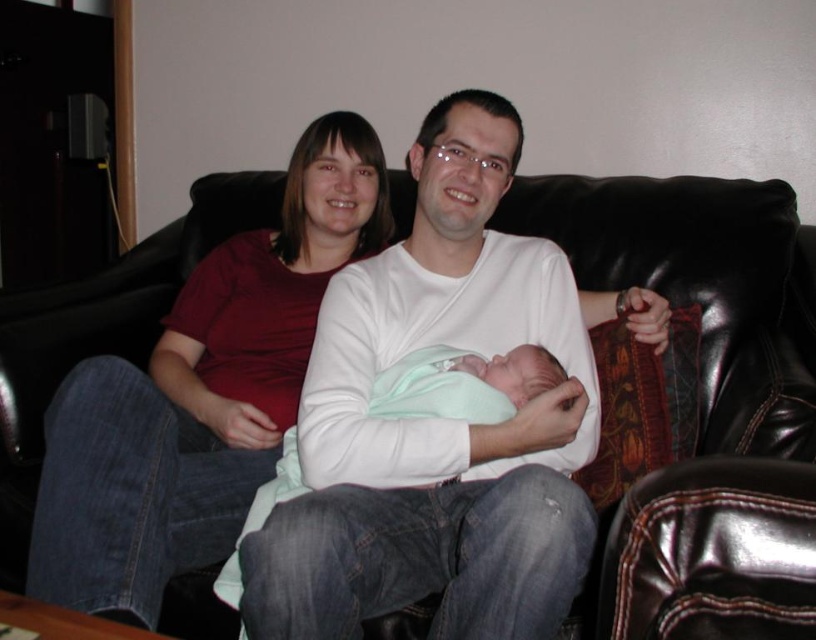
Question: Which of the following is the farthest from the observer?

Choices:
 (A) black leather couch at center
 (B) matte red shirt at upper left

Answer: (B)

Question: Does white cotton shirt at center lie in front of light green swaddled newborn at center?

Choices:
 (A) yes
 (B) no

Answer: (A)

Question: Which point appears farthest from the camera in this image?

Choices:
 (A) (240, 384)
 (B) (479, 268)
 (C) (453, 392)
 (D) (747, 449)

Answer: (A)

Question: Can you confirm if matte red shirt at upper left is smaller than light green swaddled newborn at center?

Choices:
 (A) yes
 (B) no

Answer: (B)

Question: Which of the following is the closest to the observer?

Choices:
 (A) light green swaddled newborn at center
 (B) matte red shirt at upper left

Answer: (B)

Question: Can you confirm if black leather couch at center is positioned below matte red shirt at upper left?

Choices:
 (A) yes
 (B) no

Answer: (A)